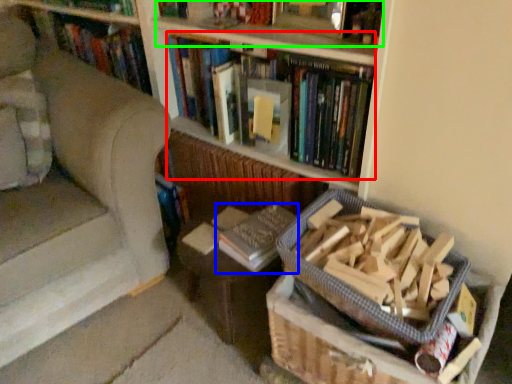
Question: Which is nearer to the book (highlighted by a red box)? book (highlighted by a blue box) or book (highlighted by a green box).

Choices:
 (A) book
 (B) book

Answer: (B)